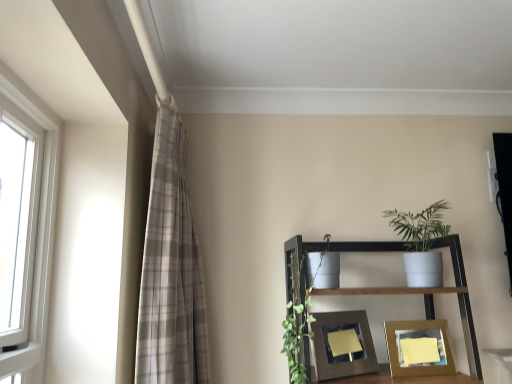
Question: From a real-world perspective, is plaid fabric curtain at left above or below white plastic window at left?

Choices:
 (A) above
 (B) below

Answer: (B)

Question: In terms of width, does plaid fabric curtain at left look wider or thinner when compared to white plastic window at left?

Choices:
 (A) thin
 (B) wide

Answer: (B)

Question: Which object is the farthest from the wooden picture frame at lower center, the 1th picture frame from the right?

Choices:
 (A) plaid fabric curtain at left
 (B) matte brown picture frame at center, which appears as the second picture frame when viewed from the right
 (C) white matte pot at upper right
 (D) white plastic window at left

Answer: (D)

Question: Estimate the real-world distances between objects in this image. Which object is farther from the matte brown picture frame at center, the 1th picture frame from the left?

Choices:
 (A) plaid fabric curtain at left
 (B) white plastic window at left
 (C) white matte pot at upper right
 (D) wooden picture frame at lower center, which is the 2th picture frame from left to right

Answer: (B)